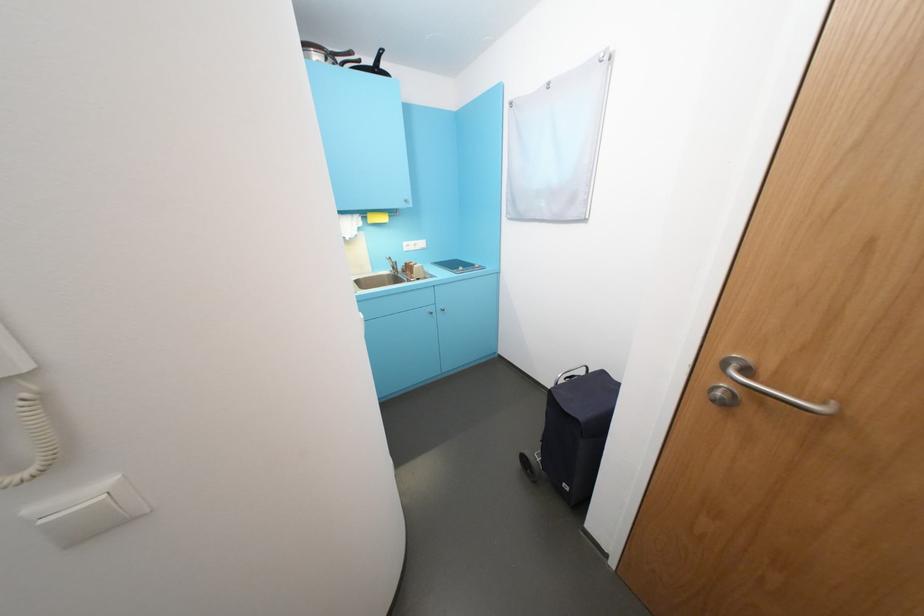
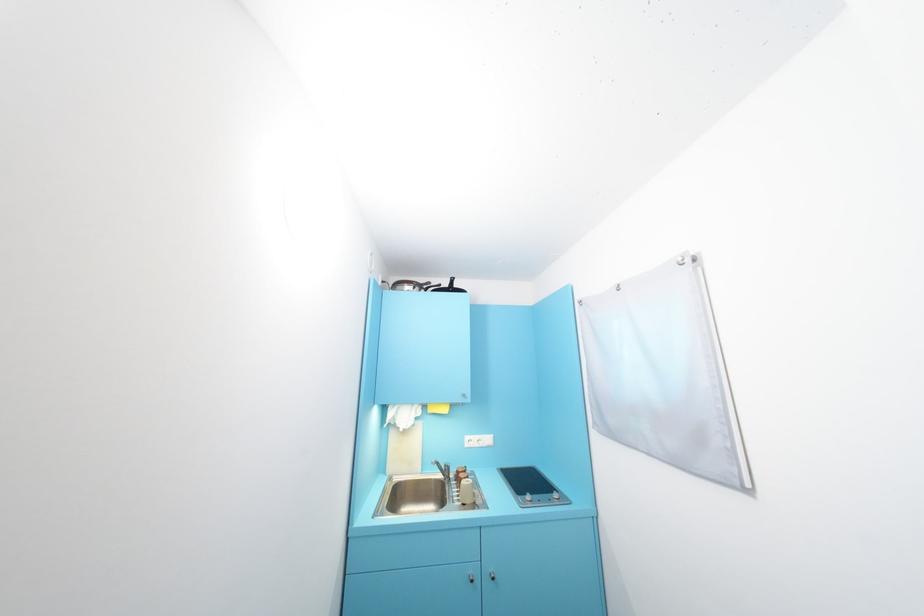
In the second image, find the point that corresponds to the point at 395,257 in the first image.

(440, 463)